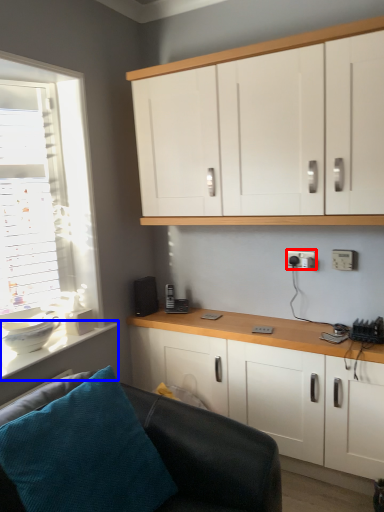
Question: Which object appears farthest to the camera in this image, electric outlet (highlighted by a red box) or counter top (highlighted by a blue box)?

Choices:
 (A) electric outlet
 (B) counter top

Answer: (A)